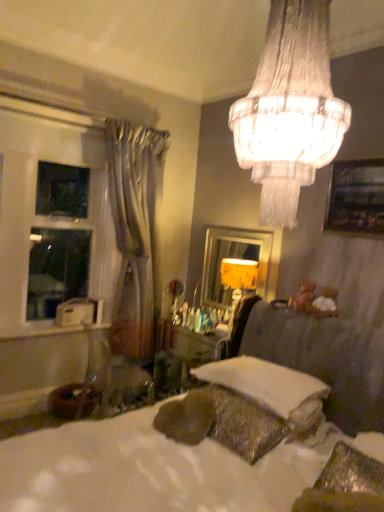
Question: Is crystalline glass chandelier at upper center at the right side of white textured bed at center?

Choices:
 (A) no
 (B) yes

Answer: (B)

Question: Considering the relative sizes of crystalline glass chandelier at upper center and white textured bed at center in the image provided, is crystalline glass chandelier at upper center bigger than white textured bed at center?

Choices:
 (A) yes
 (B) no

Answer: (B)

Question: Does crystalline glass chandelier at upper center come behind white textured bed at center?

Choices:
 (A) yes
 (B) no

Answer: (A)

Question: Considering the relative sizes of crystalline glass chandelier at upper center and white textured bed at center in the image provided, is crystalline glass chandelier at upper center wider than white textured bed at center?

Choices:
 (A) yes
 (B) no

Answer: (B)

Question: Is crystalline glass chandelier at upper center smaller than white textured bed at center?

Choices:
 (A) no
 (B) yes

Answer: (B)

Question: Is white glossy window at left wider or thinner than white textured bed at center?

Choices:
 (A) wide
 (B) thin

Answer: (B)

Question: Which is correct: white glossy window at left is inside white textured bed at center, or outside of it?

Choices:
 (A) inside
 (B) outside

Answer: (B)

Question: In the image, is white glossy window at left positioned in front of or behind white textured bed at center?

Choices:
 (A) behind
 (B) front

Answer: (A)

Question: Considering the relative positions of white glossy window at left and white textured bed at center in the image provided, is white glossy window at left to the left or to the right of white textured bed at center?

Choices:
 (A) left
 (B) right

Answer: (A)

Question: Is white soft pillow at lower center situated inside silvery drapery at left or outside?

Choices:
 (A) inside
 (B) outside

Answer: (B)

Question: In terms of size, does white soft pillow at lower center appear bigger or smaller than silvery drapery at left?

Choices:
 (A) small
 (B) big

Answer: (A)

Question: From a real-world perspective, relative to silvery drapery at left, is white soft pillow at lower center vertically above or below?

Choices:
 (A) below
 (B) above

Answer: (A)

Question: From the image's perspective, is white soft pillow at lower center located above or below silvery drapery at left?

Choices:
 (A) above
 (B) below

Answer: (B)

Question: Is white glossy window at left to the left or to the right of white soft pillow at lower center in the image?

Choices:
 (A) right
 (B) left

Answer: (B)

Question: Is white glossy window at left in front of or behind white soft pillow at lower center in the image?

Choices:
 (A) behind
 (B) front

Answer: (A)